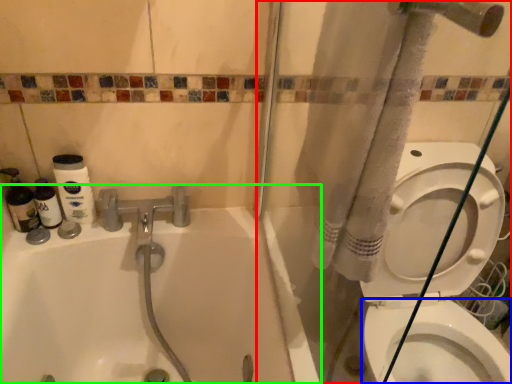
Question: Which is nearer to the shower door (highlighted by a red box)? bidet (highlighted by a blue box) or bathtub (highlighted by a green box).

Choices:
 (A) bidet
 (B) bathtub

Answer: (B)